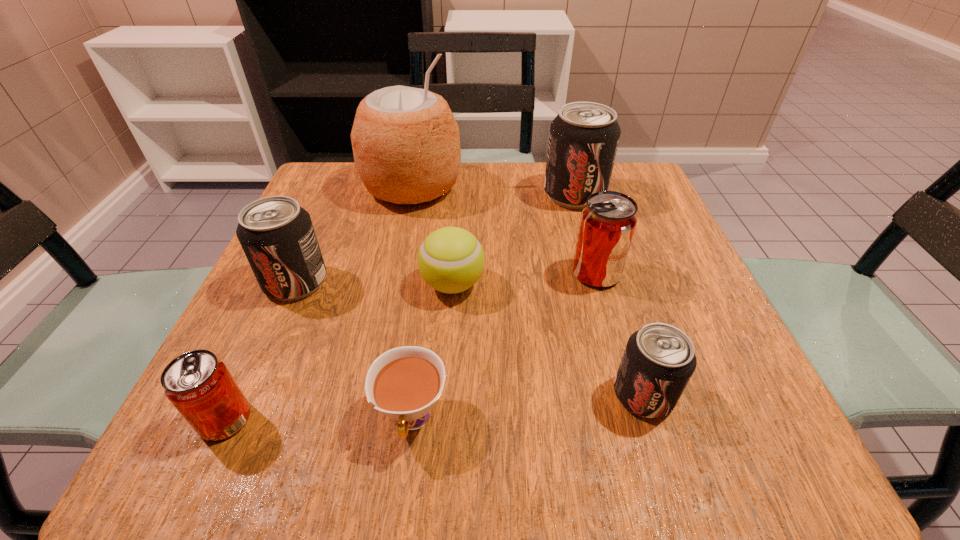
What are the coordinates of `vacant space at the left edge of the desktop` in the screenshot? It's located at (309, 382).

This screenshot has width=960, height=540. Identify the location of free space at the right edge of the desktop. (697, 390).

You are a GUI agent. You are given a task and a screenshot of the screen. Output one action in this format:
    pyautogui.click(x=<x>, y=<y>)
    Task: Click on the free point at the far left corner
    
    Given the screenshot: What is the action you would take?
    348,210

In the image, there is a desktop. What are the coordinates of `vacant region at the near left corner` in the screenshot? It's located at (252, 455).

Locate an element on the screen. free spot at the far right corner of the desktop is located at coordinates (639, 201).

This screenshot has width=960, height=540. I want to click on free space between the tallest object and the second biggest black soda can, so click(x=354, y=234).

Identify the location of empty location between the left red pop soda and the tallest pop soda. This screenshot has height=540, width=960. (400, 307).

The width and height of the screenshot is (960, 540). I want to click on free space between the shortest object and the leftmost black soda can, so click(354, 350).

Where is `vacant space that is in between the right red pop soda and the smallest black soda can`? The width and height of the screenshot is (960, 540). vacant space that is in between the right red pop soda and the smallest black soda can is located at coordinates (619, 334).

Locate an element on the screen. The image size is (960, 540). vacant space in between the left red pop soda and the tallest object is located at coordinates (319, 303).